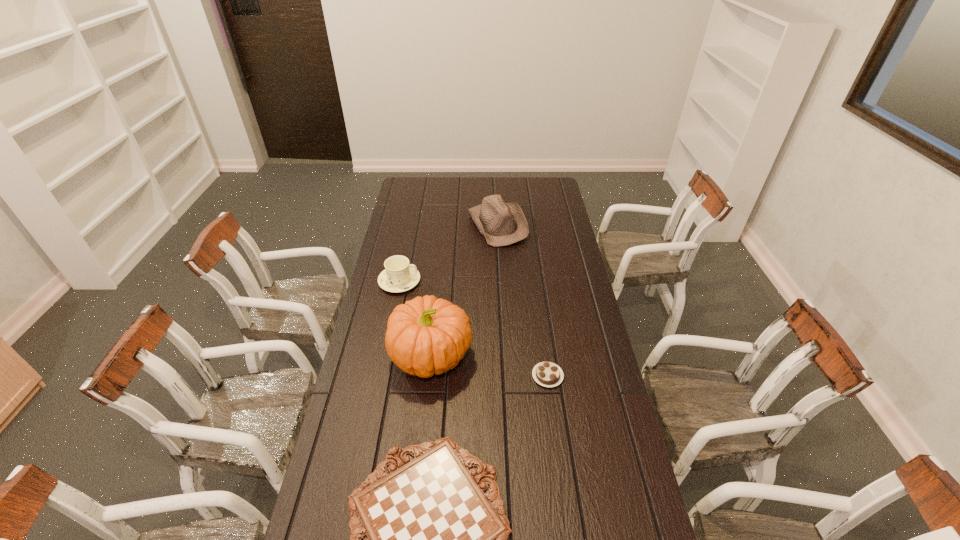
Find the location of a particular element. This screenshot has width=960, height=540. pumpkin is located at coordinates (425, 336).

The width and height of the screenshot is (960, 540). In order to click on the fourth shortest object in this screenshot , I will do `click(501, 223)`.

You are a GUI agent. You are given a task and a screenshot of the screen. Output one action in this format:
    pyautogui.click(x=<x>, y=<y>)
    Task: Click on the farthest object
    The image size is (960, 540).
    Given the screenshot: What is the action you would take?
    pyautogui.click(x=501, y=223)

Locate an element on the screen. The image size is (960, 540). chinaware is located at coordinates (399, 276).

Find the location of `the second farthest object`. the second farthest object is located at coordinates (399, 276).

The height and width of the screenshot is (540, 960). In order to click on the second shortest object in this screenshot , I will do `click(548, 374)`.

You are a GUI agent. You are given a task and a screenshot of the screen. Output one action in this format:
    pyautogui.click(x=<x>, y=<y>)
    Task: Click on the free space located 0.200m on the surface of the pumpkin
    Image resolution: width=960 pixels, height=540 pixels.
    Given the screenshot: What is the action you would take?
    pyautogui.click(x=528, y=356)

Where is `vacant space located 0.180m on the left of the fourth shortest object`? This screenshot has height=540, width=960. vacant space located 0.180m on the left of the fourth shortest object is located at coordinates (432, 225).

Locate an element on the screen. This screenshot has height=540, width=960. vacant space located 0.290m on the handle side of the second farthest object is located at coordinates (488, 281).

Locate an element on the screen. The image size is (960, 540). vacant point located on the back of the fourth tallest object is located at coordinates (542, 338).